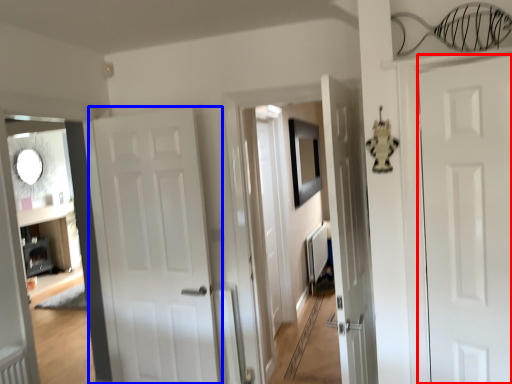
Question: Which point is closer to the camera, door (highlighted by a red box) or door (highlighted by a blue box)?

Choices:
 (A) door
 (B) door

Answer: (A)